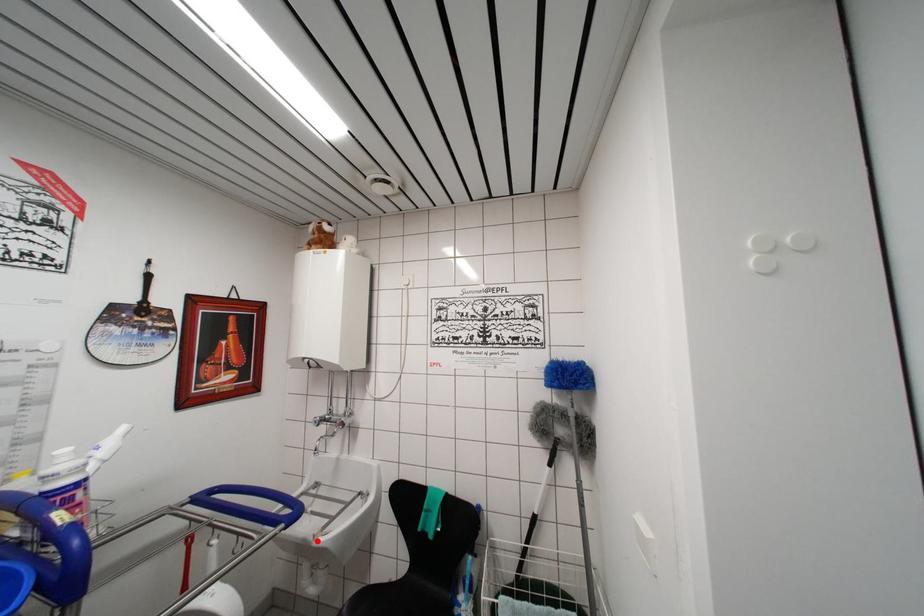
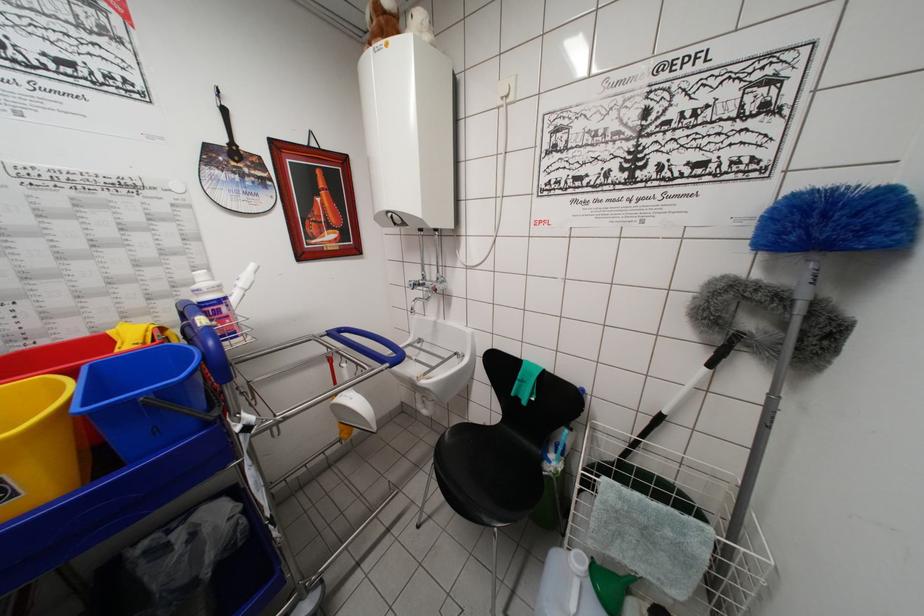
Locate, in the second image, the point that corresponds to the highlighted location in the first image.

(420, 383)